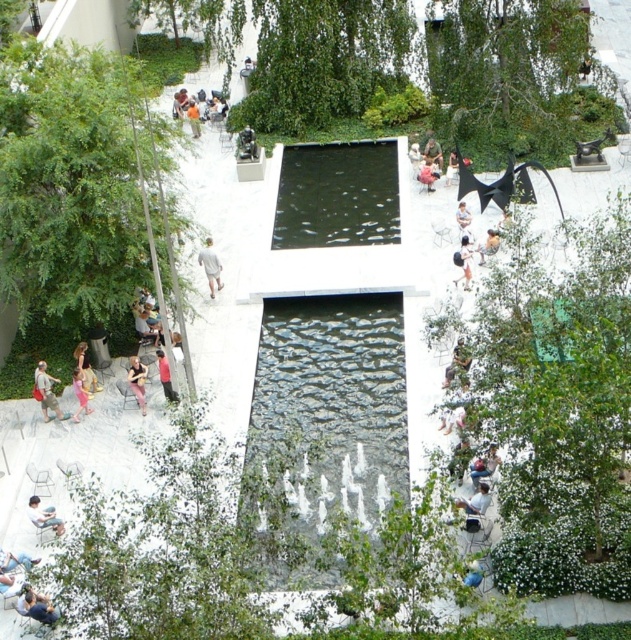
You are a photographer standing at the edge of the water feature. You want to capture a photo where the black reflective water at center and the light brown leather jacket at center right are both visible. Which object will appear taller in the photo?

The black reflective water at center will appear taller in the photo because it has a greater height compared to the light brown leather jacket at center right.

You are a photographer standing at the edge of the water feature. You want to take a photo of the light brown leather jacket at center right without the black reflective water at center appearing in the foreground. Is this possible given their positions?

The light brown leather jacket at center right is behind the black reflective water at center, so the black reflective water at center will block the view of the jacket. Therefore, it is not possible to take a photo of the light brown leather jacket at center right without the black reflective water at center appearing in the foreground.